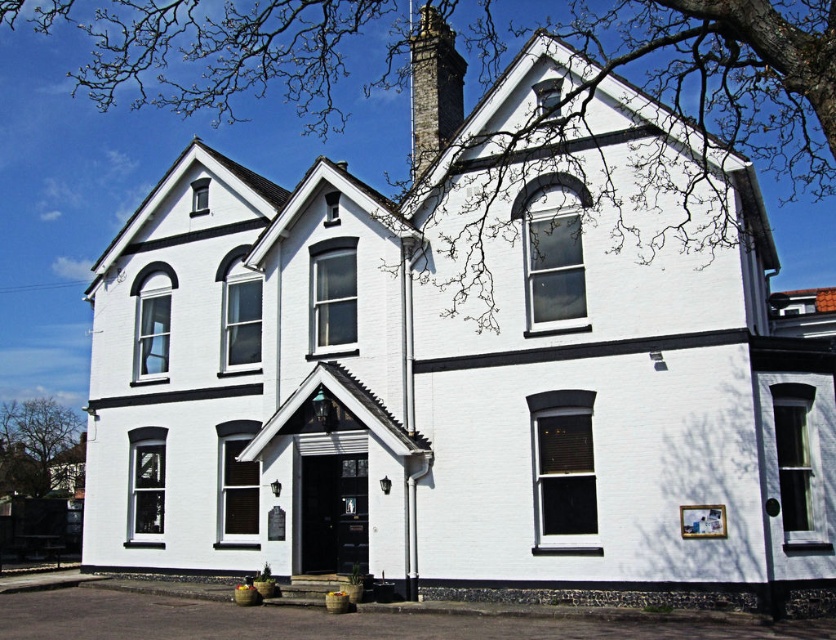
Question: Can you confirm if stone chimney at upper center is thinner than bare branches at left?

Choices:
 (A) no
 (B) yes

Answer: (B)

Question: Is bare branches at upper center below stone chimney at upper center?

Choices:
 (A) no
 (B) yes

Answer: (A)

Question: In this image, where is bare branches at upper center located relative to bare branches at left?

Choices:
 (A) right
 (B) left

Answer: (A)

Question: Which object is positioned farthest from the bare branches at upper center?

Choices:
 (A) bare branches at left
 (B) stone chimney at upper center

Answer: (A)

Question: Which is nearer to the bare branches at left?

Choices:
 (A) bare branches at upper center
 (B) stone chimney at upper center

Answer: (A)

Question: Which point is farther to the camera?

Choices:
 (A) (427, 120)
 (B) (44, 440)

Answer: (B)